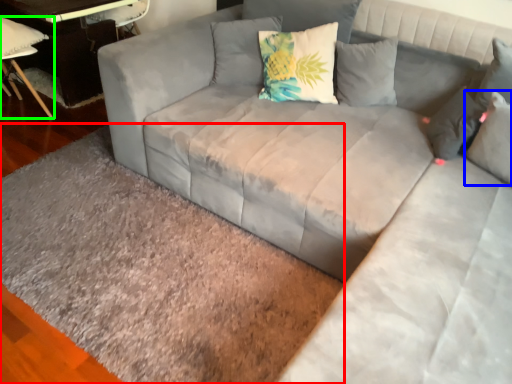
Question: Considering the real-world distances, which object is farthest from mat (highlighted by a red box)? pillow (highlighted by a blue box) or chair (highlighted by a green box)?

Choices:
 (A) pillow
 (B) chair

Answer: (B)